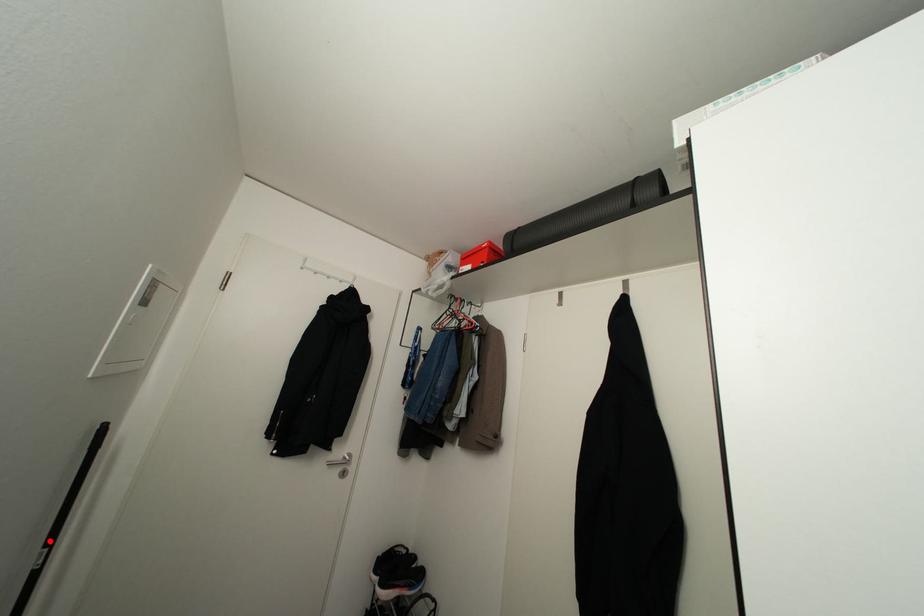
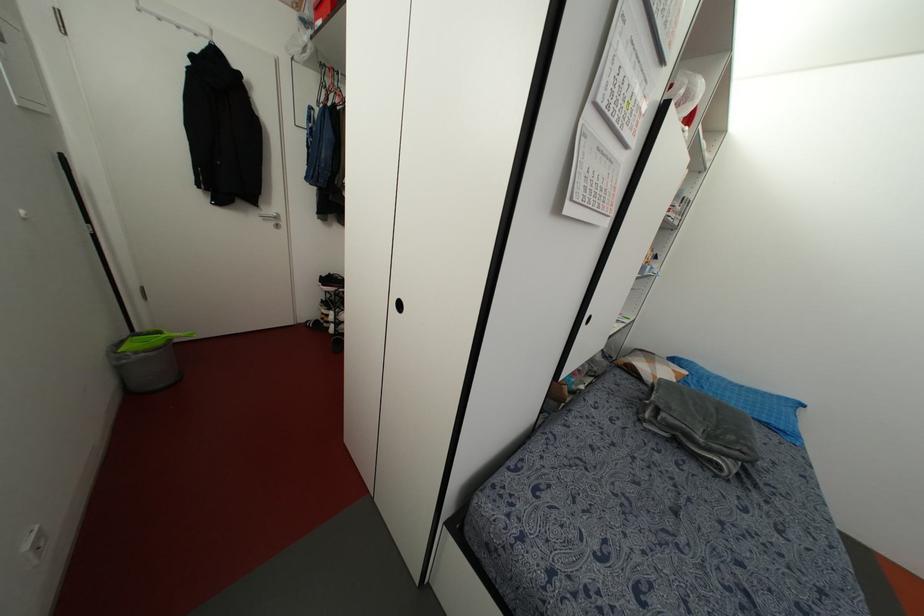
Where in the second image is the point corresponding to the highlighted location from the first image?

(88, 221)